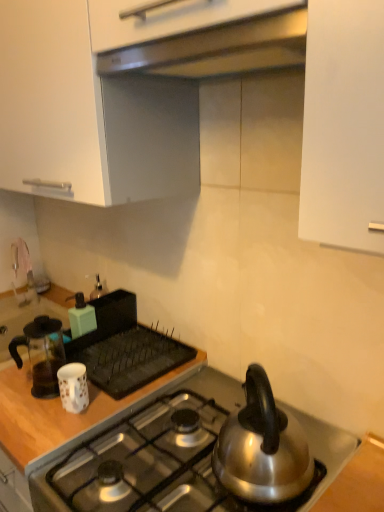
Find the location of a particular element. The image size is (384, 512). free spot behind white glossy mug at lower left, arranged as the third kitchen appliance when viewed from the back is located at coordinates (109, 364).